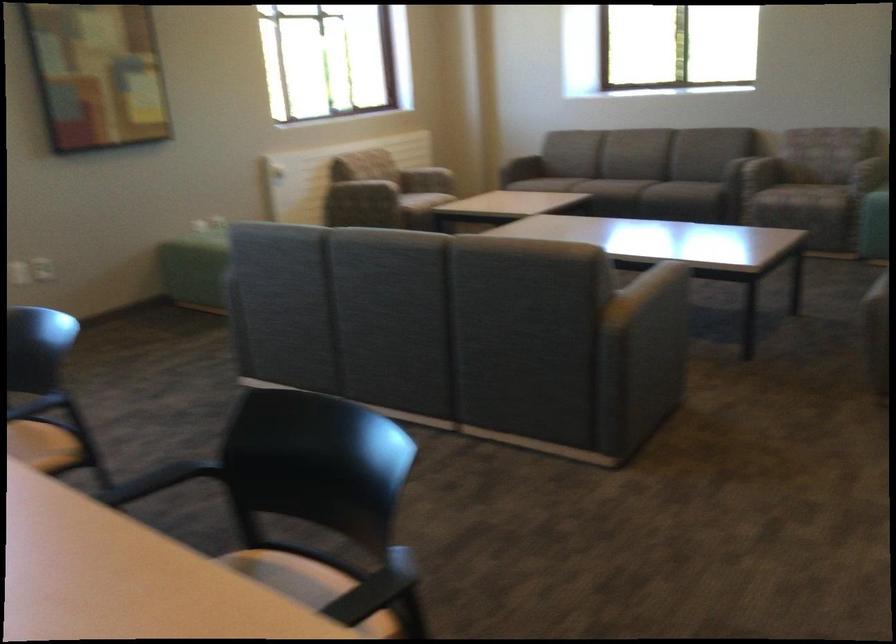
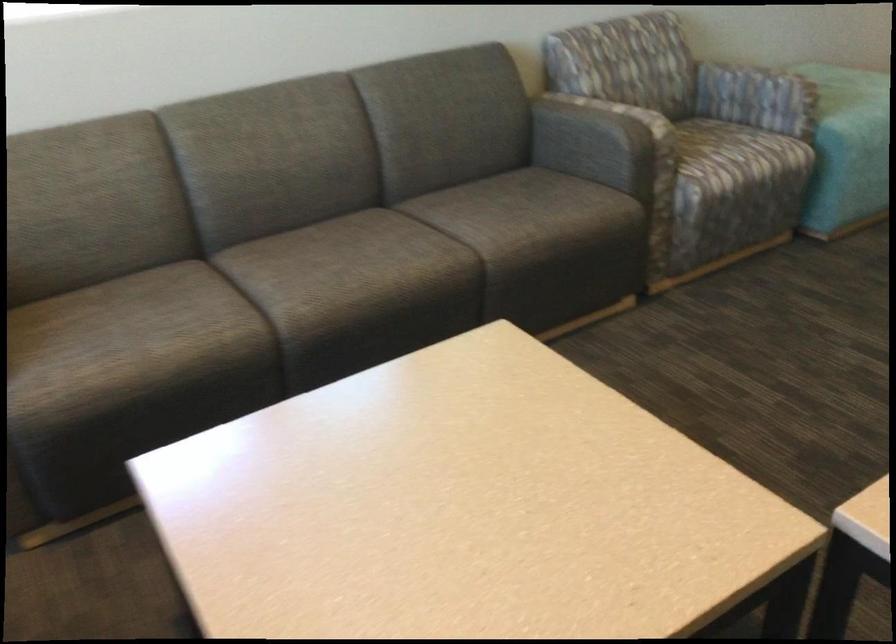
Locate, in the second image, the point that corresponds to point (778, 185) in the first image.

(737, 155)